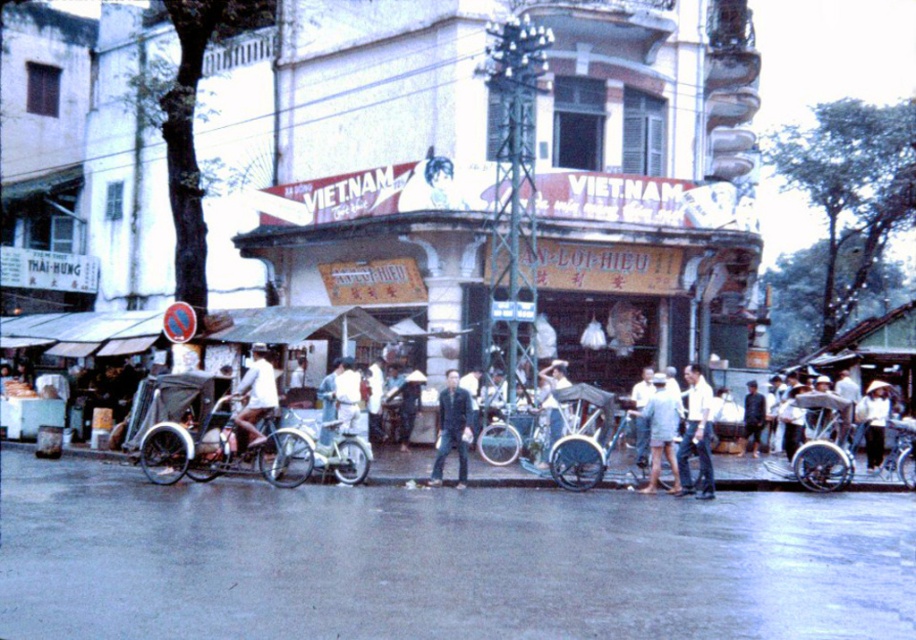
Question: Can you confirm if white cotton hat at center is smaller than light blue fabric shirt at center?

Choices:
 (A) no
 (B) yes

Answer: (A)

Question: Which of the following is the closest to the observer?

Choices:
 (A) white cotton hat at center
 (B) dark blue denim jacket at center

Answer: (B)

Question: Which object is farther from the camera taking this photo?

Choices:
 (A) light blue matte bicycle at center
 (B) metallic silver tricycle at center
 (C) white matte bicycle at center
 (D) light blue fabric shirt at center

Answer: (D)

Question: Does dark blue denim jacket at center come in front of white cotton hat at center?

Choices:
 (A) no
 (B) yes

Answer: (B)

Question: From the image, what is the correct spatial relationship of light blue matte bicycle at center in relation to dark blue fabric at center?

Choices:
 (A) below
 (B) above

Answer: (B)

Question: Which of the following is the farthest from the observer?

Choices:
 (A) white cotton hat at center
 (B) white matte bicycle at center
 (C) light blue fabric shirt at center
 (D) light blue denim shorts at center

Answer: (A)